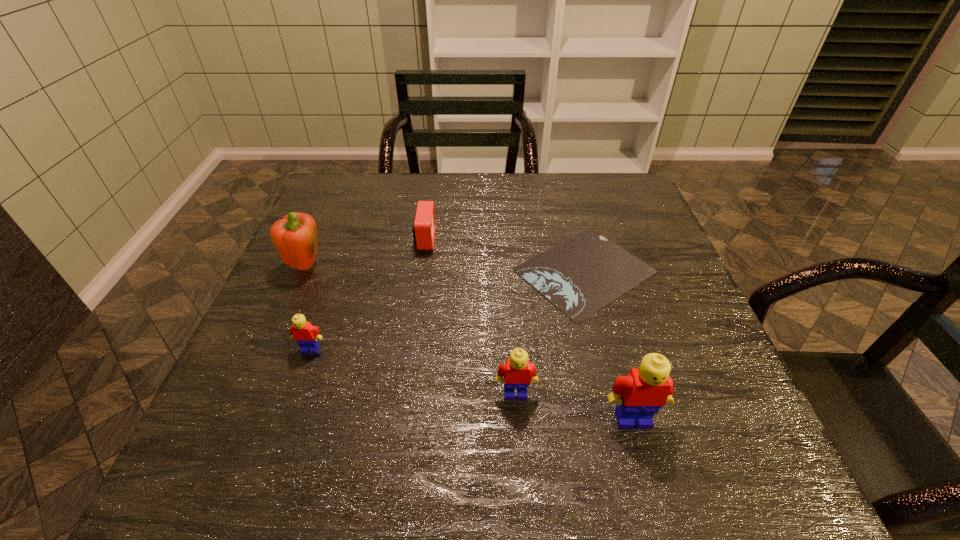
Identify the location of free space between the second nearest object and the third nearest object. (413, 371).

This screenshot has height=540, width=960. What are the coordinates of `vacant area between the tallest Lego and the alarm clock` in the screenshot? It's located at (529, 329).

Locate an element on the screen. This screenshot has height=540, width=960. unoccupied position between the leftmost object and the fourth farthest object is located at coordinates (308, 307).

This screenshot has width=960, height=540. I want to click on free space between the leftmost Lego and the alarm clock, so click(368, 294).

Locate an element on the screen. Image resolution: width=960 pixels, height=540 pixels. free spot between the mousepad and the nearest object is located at coordinates click(x=609, y=345).

The height and width of the screenshot is (540, 960). I want to click on object that stands as the third closest to the alarm clock, so click(x=306, y=335).

The height and width of the screenshot is (540, 960). I want to click on object that is the third closest to the leftmost object, so click(581, 275).

Point out which Lego is positioned as the second nearest to the third tallest object. Please provide its 2D coordinates. Your answer should be formatted as a tuple, i.e. [(x, y)], where the tuple contains the x and y coordinates of a point satisfying the conditions above.

[(306, 335)]

The image size is (960, 540). Find the location of `Lego object that ranks as the second closest to the second nearest Lego`. Lego object that ranks as the second closest to the second nearest Lego is located at coordinates (306, 335).

Where is `blank area in the image that satisfies the following two spatial constraints: 1. on the front-facing side of the third object from left to right; 2. on the front-facing side of the shortest Lego`? The image size is (960, 540). blank area in the image that satisfies the following two spatial constraints: 1. on the front-facing side of the third object from left to right; 2. on the front-facing side of the shortest Lego is located at coordinates (409, 349).